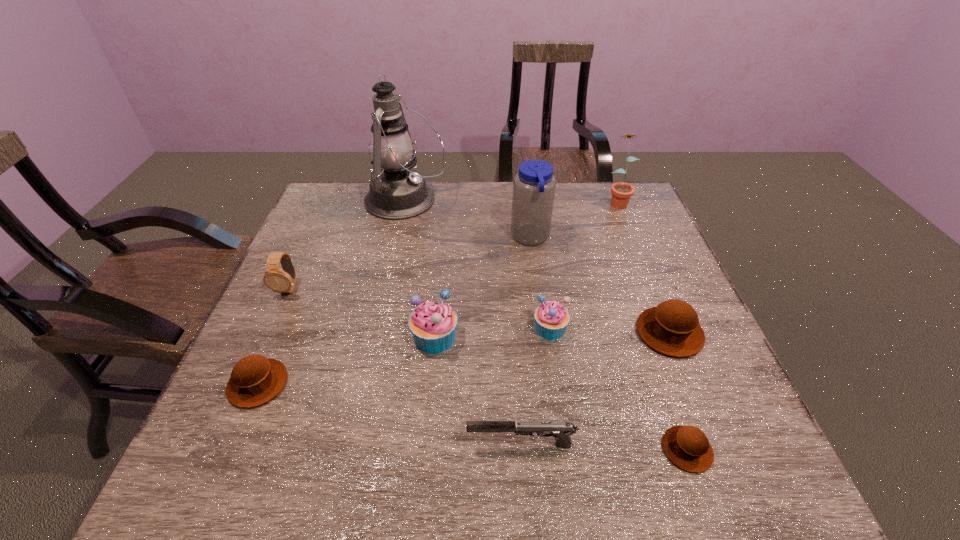
You are a GUI agent. You are given a task and a screenshot of the screen. Output one action in this format:
    pyautogui.click(x=<x>, y=<y>)
    Task: Click on the oil lamp
    This screenshot has width=960, height=540.
    Given the screenshot: What is the action you would take?
    pyautogui.click(x=396, y=192)

Where is `sunflower`? The image size is (960, 540). sunflower is located at coordinates (621, 192).

Locate an element on the screen. water bottle is located at coordinates (534, 186).

Find the location of a particular element. the eighth nearest object is located at coordinates (534, 186).

Image resolution: width=960 pixels, height=540 pixels. I want to click on the left blue muffin, so point(433,324).

Locate an element on the screen. the tallest muffin is located at coordinates (433, 324).

The image size is (960, 540). What are the coordinates of `watch` in the screenshot? It's located at (281, 281).

This screenshot has width=960, height=540. In order to click on the right blue muffin in this screenshot , I will do `click(551, 318)`.

Locate an element on the screen. The width and height of the screenshot is (960, 540). the smaller blue muffin is located at coordinates (551, 318).

The height and width of the screenshot is (540, 960). What are the coordinates of `the farthest brown muffin` in the screenshot? It's located at (672, 328).